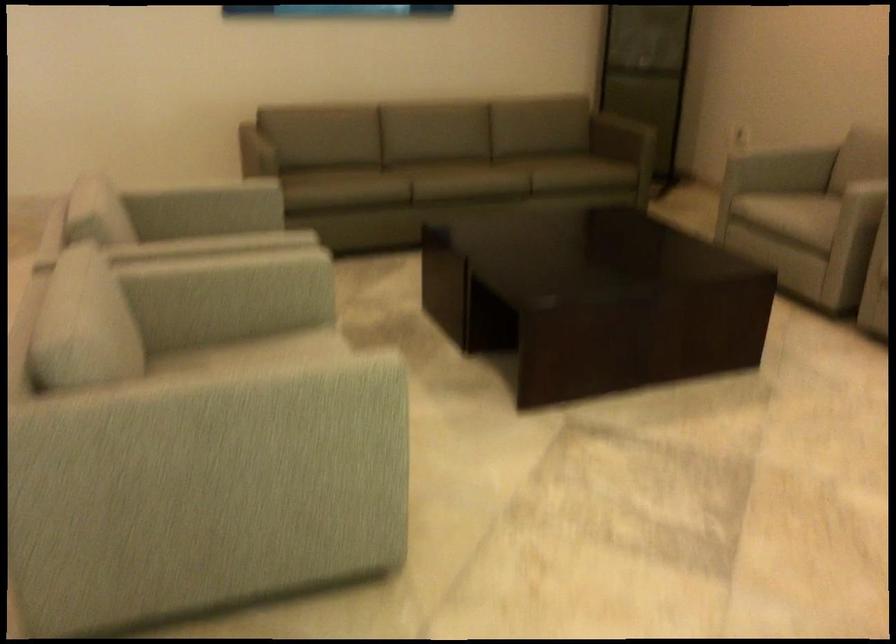
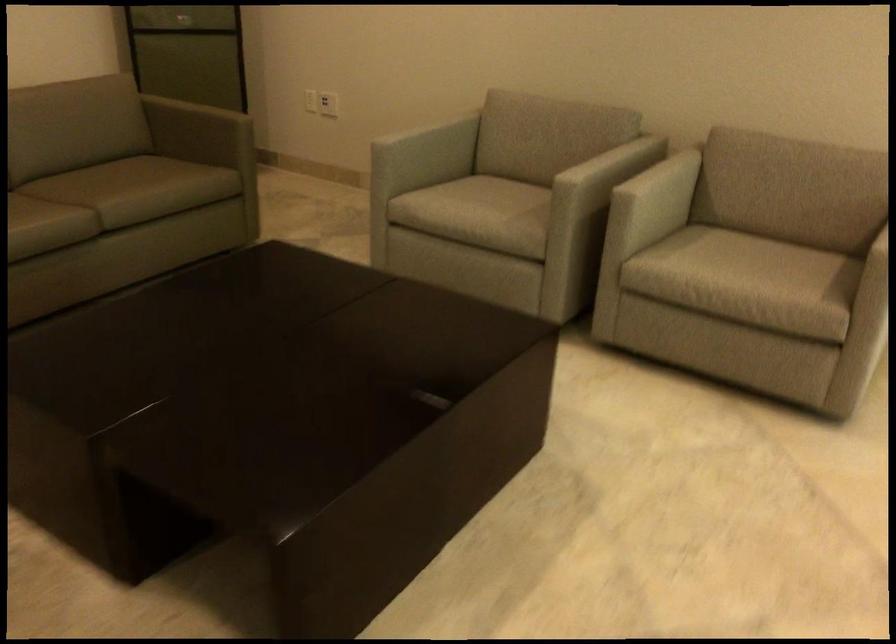
Question: I am providing you with two images of the same scene from different viewpoints. After the viewpoint changes to image2, which objects are now occluded?

Choices:
 (A) green sofa sitting surface
 (B) white electrical outlet
 (C) light gray chair sitting surface
 (D) none of these

Answer: (D)